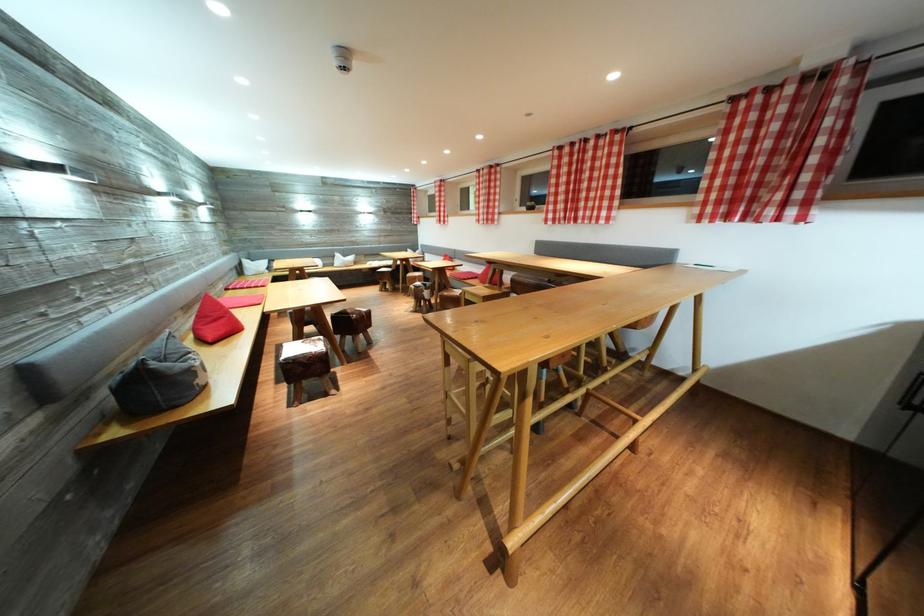
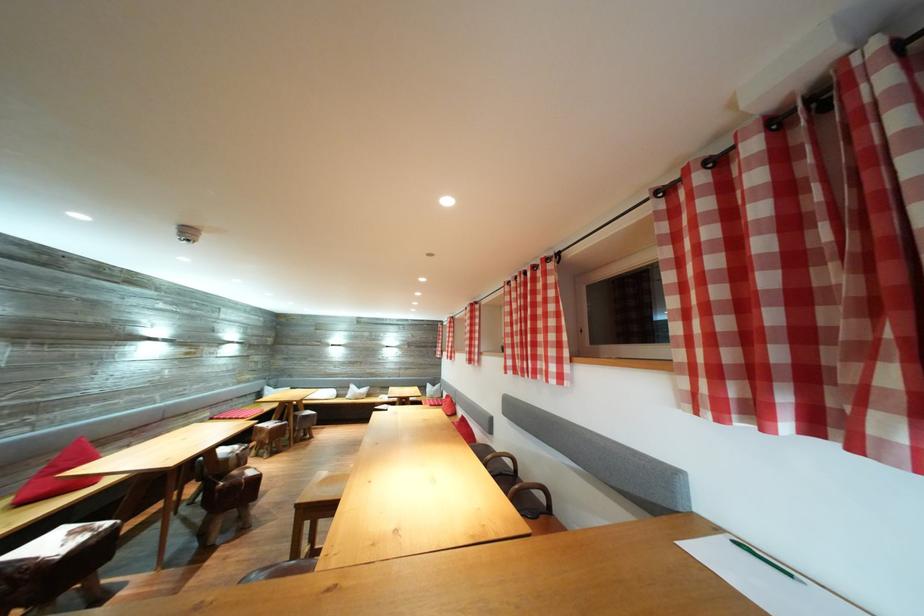
Find the pixel in the second image that matches point 355,317 in the first image.

(241, 477)